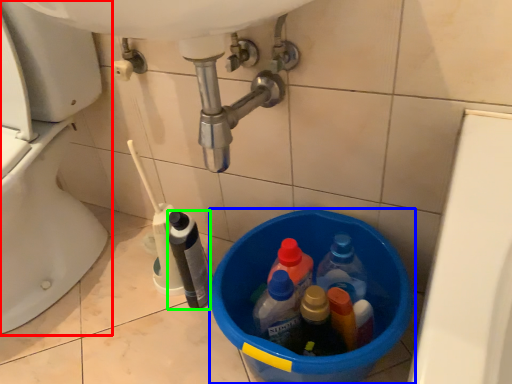
Question: Considering the real-world distances, which object is closest to toilet (highlighted by a red box)? basin (highlighted by a blue box) or bottle (highlighted by a green box).

Choices:
 (A) basin
 (B) bottle

Answer: (B)